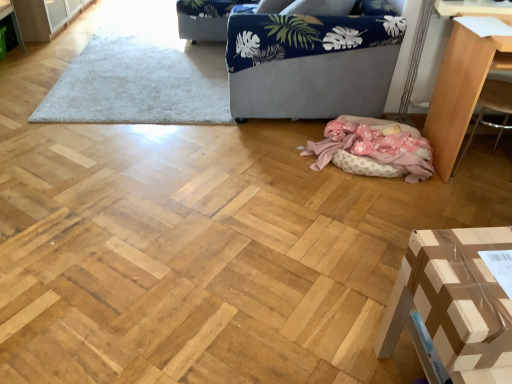
Locate an element on the screen. Image resolution: width=512 pixels, height=384 pixels. free spot in front of white shaggy rug at upper center is located at coordinates (108, 185).